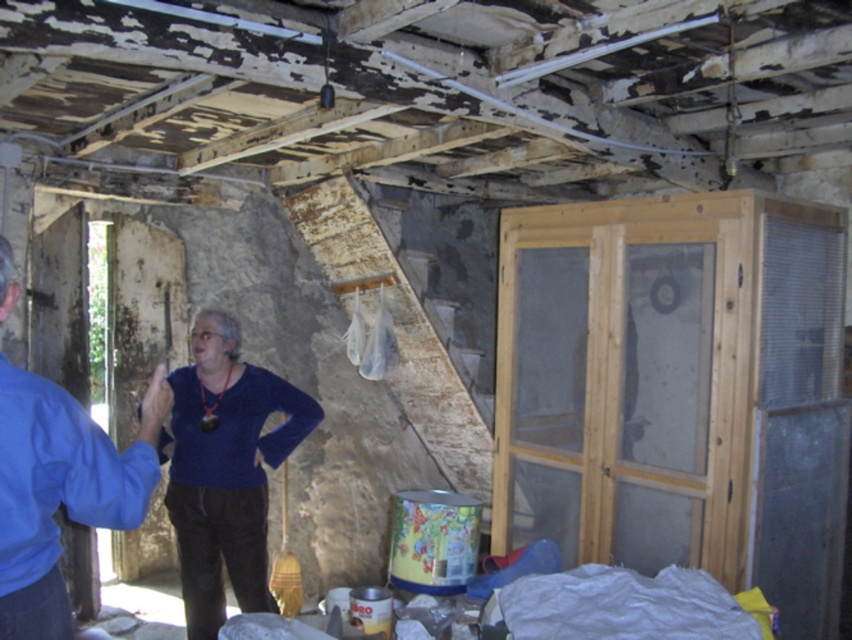
Which is more to the left, blue velvet sweater at center or blue fabric shirt at left?

blue velvet sweater at center is more to the left.

Between point (179, 561) and point (39, 410), which one is positioned in front?

Point (39, 410) is more forward.

Find the location of `blue velvet sweater at center`. blue velvet sweater at center is located at coordinates (225, 468).